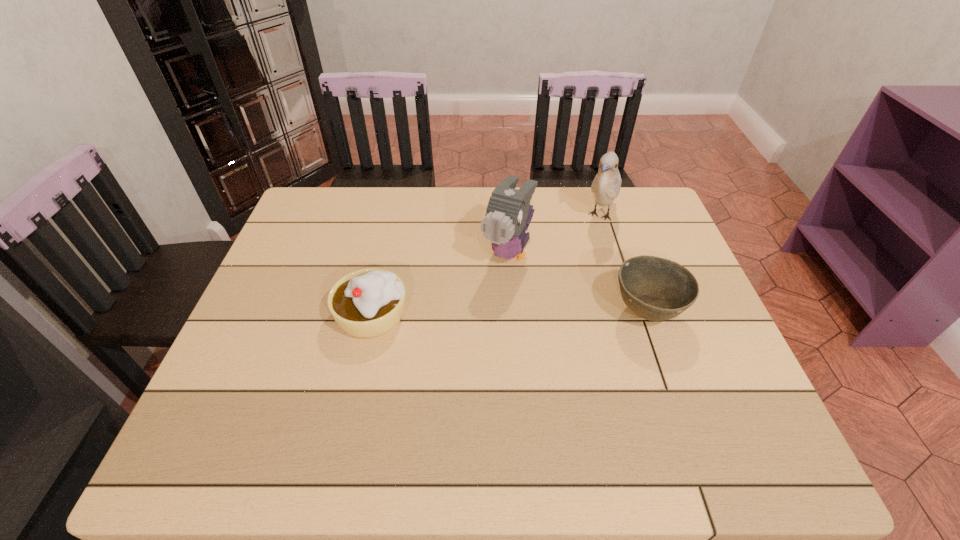
Locate an element on the screen. This screenshot has height=540, width=960. vacant space on the desktop that is between the whipped cream and the bowl and is positioned at the beak of the right bird is located at coordinates (548, 313).

Locate an element on the screen. The width and height of the screenshot is (960, 540). free space on the desktop that is between the whipped cream and the bowl and is positioned at the beak of the left bird is located at coordinates (471, 314).